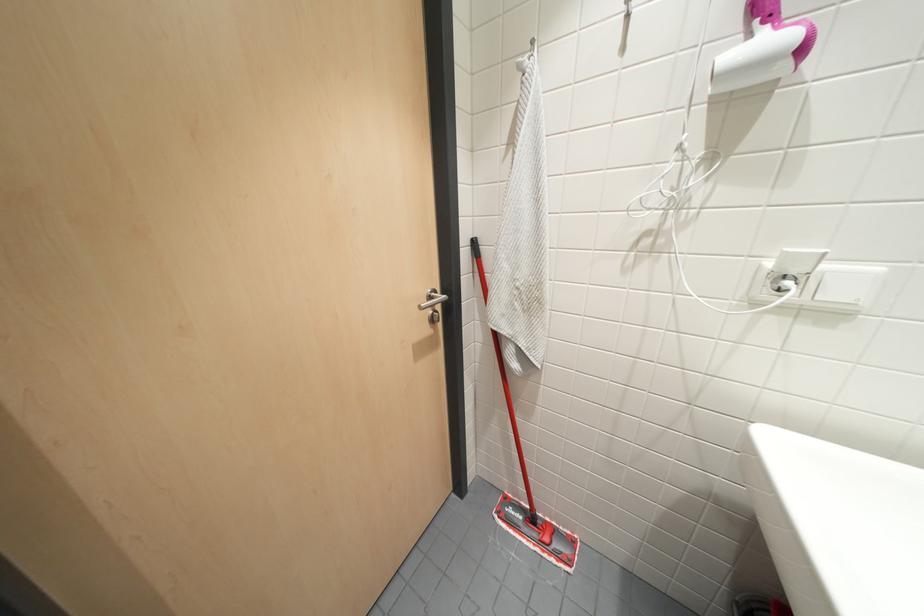
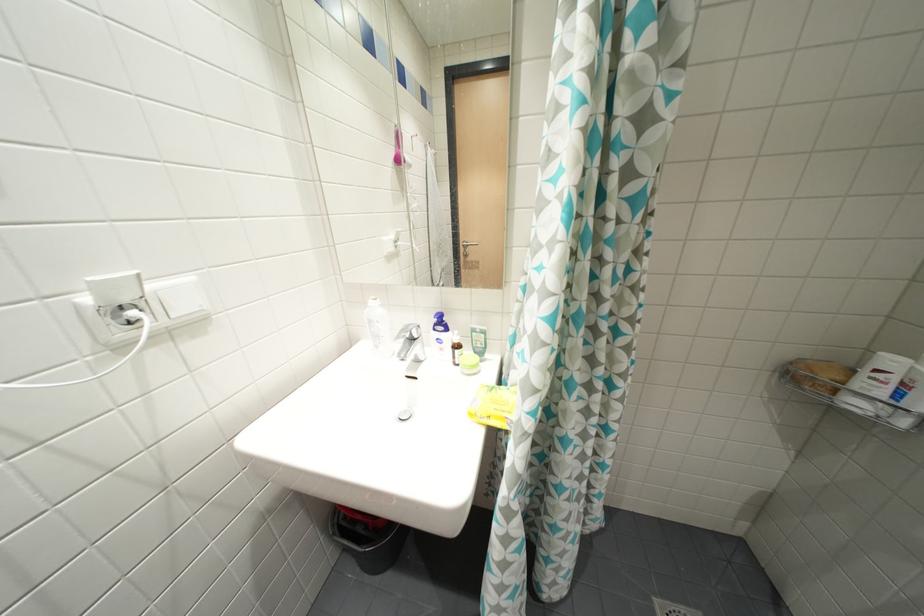
The first image is from the beginning of the video and the second image is from the end. How did the camera likely rotate when shooting the video?

The rotation direction of the camera is right-down.